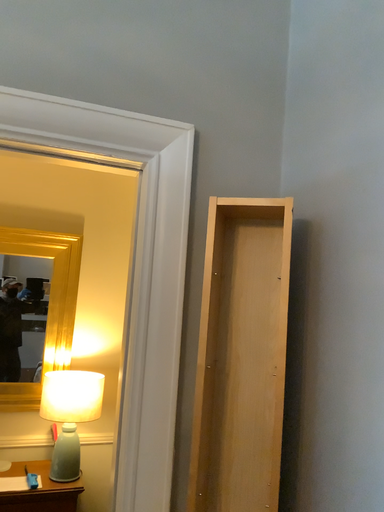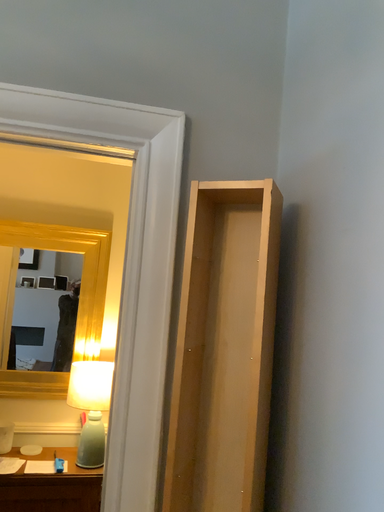
Question: Which way did the camera rotate in the video?

Choices:
 (A) rotated left
 (B) rotated right

Answer: (A)